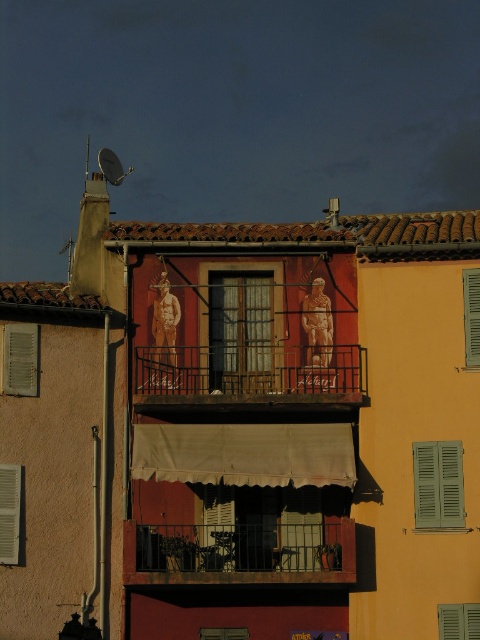
Who is shorter, metallic black balcony at center or green wooden shutter at left?

metallic black balcony at center is shorter.

Identify the location of metallic black balcony at center. (238, 552).

Does green matte shutters at center have a smaller size compared to green matte shutter at left?

Incorrect, green matte shutters at center is not smaller in size than green matte shutter at left.

Can you confirm if green matte shutters at center is bigger than green matte shutter at left?

Correct, green matte shutters at center is larger in size than green matte shutter at left.

At what (x,y) coordinates should I click in order to perform the action: click on green matte shutters at center. Please return your answer as a coordinate pair (x, y). The height and width of the screenshot is (640, 480). Looking at the image, I should click on (437, 484).

The width and height of the screenshot is (480, 640). Find the location of `green matte shutters at center`. green matte shutters at center is located at coordinates (437, 484).

Between green matte shutter at center and green matte shutters at center, which one appears on the left side from the viewer's perspective?

From the viewer's perspective, green matte shutter at center appears more on the left side.

Looking at this image, which of these two, green matte shutter at center or green matte shutters at center, stands taller?

With more height is green matte shutter at center.

Is point (239, 372) positioned behind point (420, 467)?

Yes, it is.

Find the location of a particular element. The width and height of the screenshot is (480, 640). green matte shutter at center is located at coordinates (240, 332).